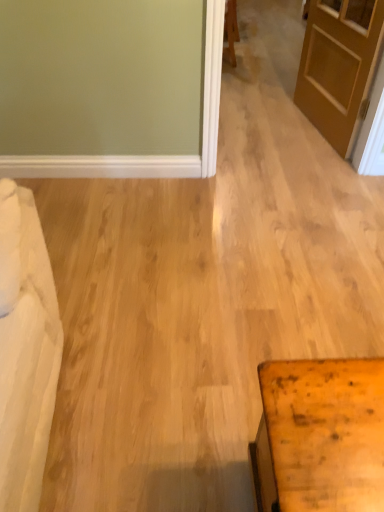
I want to click on free space in front of matte wooden door at upper right, so click(x=312, y=161).